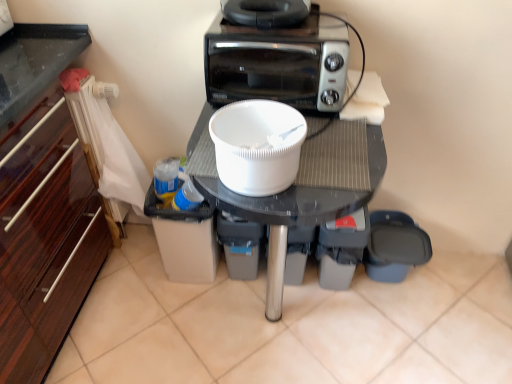
Question: Considering the positions of white plastic table at center and white plastic bowl at center in the image, is white plastic table at center bigger or smaller than white plastic bowl at center?

Choices:
 (A) small
 (B) big

Answer: (B)

Question: Is point (314, 170) closer or farther from the camera than point (232, 185)?

Choices:
 (A) farther
 (B) closer

Answer: (A)

Question: Which object is the closest to the black plastic toaster at upper center?

Choices:
 (A) black rubber toaster at upper center
 (B) white plastic bowl at center
 (C) white plastic table at center

Answer: (A)

Question: Based on their relative distances, which object is nearer to the black plastic toaster at upper center?

Choices:
 (A) black rubber toaster at upper center
 (B) white plastic table at center
 (C) white plastic bowl at center

Answer: (A)